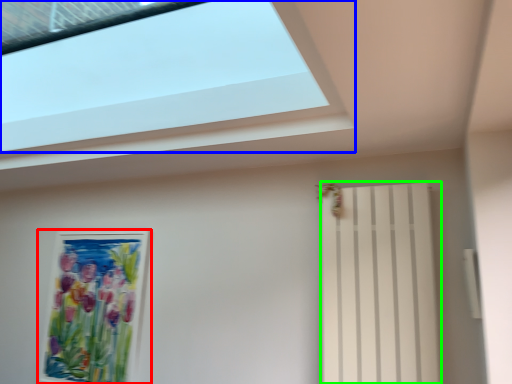
Question: Considering the real-world distances, which object is closest to picture frame (highlighted by a red box)? window (highlighted by a blue box) or shutter (highlighted by a green box).

Choices:
 (A) window
 (B) shutter

Answer: (A)